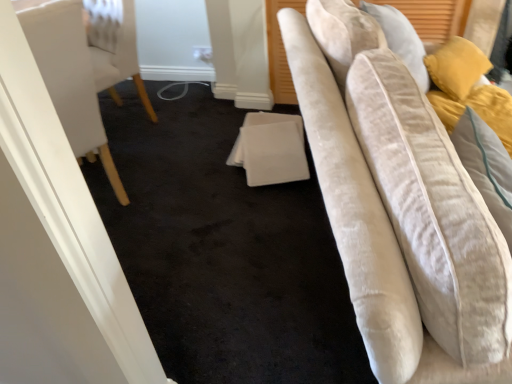
The image size is (512, 384). What do you see at coordinates (270, 149) in the screenshot?
I see `white fabric at center` at bounding box center [270, 149].

This screenshot has height=384, width=512. In order to click on white fabric at center in this screenshot , I will do `click(270, 149)`.

Measure the distance between point (298,177) and camera.

They are 2.24 meters apart.

Locate an element on the screen. The image size is (512, 384). velvet beige chair at left is located at coordinates (69, 77).

The image size is (512, 384). Describe the element at coordinates (69, 77) in the screenshot. I see `velvet beige chair at left` at that location.

What are the coordinates of `white fabric at center` in the screenshot? It's located at (270, 149).

Which is more to the left, white fabric at center or velvet beige chair at left?

Positioned to the left is velvet beige chair at left.

Is white fabric at center further to camera compared to velvet beige chair at left?

Yes.

Which is closer, (265,116) or (39,58)?

Positioned in front is point (39,58).

From the image's perspective, is white fabric at center positioned above or below velvet beige chair at left?

Clearly, from the image's perspective, white fabric at center is below velvet beige chair at left.

From a real-world perspective, is white fabric at center located higher than velvet beige chair at left?

Actually, white fabric at center is physically below velvet beige chair at left in the real world.

Considering the sizes of objects white fabric at center and velvet beige chair at left in the image provided, who is thinner, white fabric at center or velvet beige chair at left?

white fabric at center.

Considering the sizes of objects white fabric at center and velvet beige chair at left in the image provided, who is taller, white fabric at center or velvet beige chair at left?

Standing taller between the two is velvet beige chair at left.

Considering the relative sizes of white fabric at center and velvet beige chair at left in the image provided, is white fabric at center bigger than velvet beige chair at left?

No, white fabric at center is not bigger than velvet beige chair at left.

Would you say white fabric at center contains velvet beige chair at left?

No, velvet beige chair at left is not a part of white fabric at center.

Are white fabric at center and velvet beige chair at left far apart?

white fabric at center is actually quite close to velvet beige chair at left.

Could you tell me if white fabric at center is turned towards velvet beige chair at left?

No, white fabric at center does not turn towards velvet beige chair at left.

What's the angular difference between white fabric at center and velvet beige chair at left's facing directions?

132 degrees.

The image size is (512, 384). Find the location of `table below the velvet beige chair at left (from the image's perspective)`. table below the velvet beige chair at left (from the image's perspective) is located at coordinates [270, 149].

Which object is positioned more to the left, velvet beige chair at left or white fabric at center?

velvet beige chair at left is more to the left.

Which object is more forward, velvet beige chair at left or white fabric at center?

velvet beige chair at left.

Which is more distant, [82,109] or [242,141]?

The point [242,141] is farther.

From the image's perspective, is velvet beige chair at left located above or below white fabric at center?

Clearly, from the image's perspective, velvet beige chair at left is above white fabric at center.

From a real-world perspective, which is physically below, velvet beige chair at left or white fabric at center?

white fabric at center.

Between velvet beige chair at left and white fabric at center, which one has smaller width?

Thinner between the two is white fabric at center.

Which of these two, velvet beige chair at left or white fabric at center, stands taller?

Standing taller between the two is velvet beige chair at left.

Is velvet beige chair at left bigger or smaller than white fabric at center?

velvet beige chair at left is bigger than white fabric at center.

Is velvet beige chair at left surrounding white fabric at center?

No, white fabric at center is not a part of velvet beige chair at left.

Is velvet beige chair at left positioned far away from white fabric at center?

No.

Is velvet beige chair at left positioned with its back to white fabric at center?

No.

You are a GUI agent. You are given a task and a screenshot of the screen. Output one action in this format:
    pyautogui.click(x=<x>, y=<y>)
    Task: Click on the table below the velvet beige chair at left (from a real-world perspective)
    
    Given the screenshot: What is the action you would take?
    pyautogui.click(x=270, y=149)

Identify the location of furniture above the white fabric at center (from the image's perspective). The image size is (512, 384). (69, 77).

Where is `furniture above the white fabric at center (from a real-world perspective)`? The height and width of the screenshot is (384, 512). furniture above the white fabric at center (from a real-world perspective) is located at coordinates (69, 77).